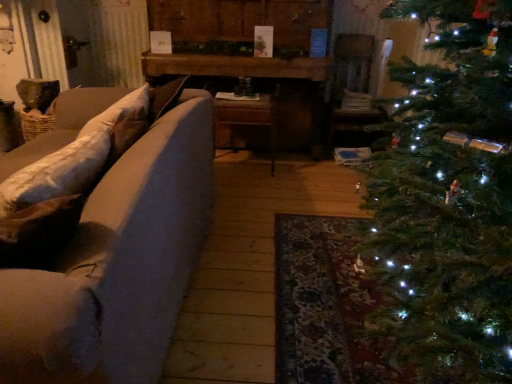
Where is `wooden table at center`? The width and height of the screenshot is (512, 384). wooden table at center is located at coordinates (255, 102).

Image resolution: width=512 pixels, height=384 pixels. What do you see at coordinates (255, 102) in the screenshot?
I see `wooden table at center` at bounding box center [255, 102].

Find the location of a particular element. Image resolution: width=512 pixels, height=384 pixels. matte gray couch at left is located at coordinates (118, 264).

What do you see at coordinates (118, 264) in the screenshot?
I see `matte gray couch at left` at bounding box center [118, 264].

The width and height of the screenshot is (512, 384). Identify the location of wooden table at center. (255, 102).

Considering the positions of objects wooden table at center and matte gray couch at left in the image provided, who is more to the right, wooden table at center or matte gray couch at left?

From the viewer's perspective, wooden table at center appears more on the right side.

Looking at this image, is wooden table at center closer to the viewer compared to matte gray couch at left?

No, it is behind matte gray couch at left.

Is point (272, 128) behind point (141, 210)?

Yes, it is.

From the image's perspective, is wooden table at center located above or below matte gray couch at left?

wooden table at center is situated higher than matte gray couch at left in the image.

From a real-world perspective, relative to matte gray couch at left, is wooden table at center vertically above or below?

From a real-world perspective, wooden table at center is physically above matte gray couch at left.

In terms of width, does wooden table at center look wider or thinner when compared to matte gray couch at left?

In the image, wooden table at center appears to be more narrow than matte gray couch at left.

In terms of height, does wooden table at center look taller or shorter compared to matte gray couch at left?

In the image, wooden table at center appears to be taller than matte gray couch at left.

In terms of size, does wooden table at center appear bigger or smaller than matte gray couch at left?

wooden table at center is smaller than matte gray couch at left.

Is wooden table at center spatially inside matte gray couch at left, or outside of it?

wooden table at center is not inside matte gray couch at left, it's outside.

Is wooden table at center in contact with matte gray couch at left?

No, wooden table at center is not beside matte gray couch at left.

Looking at this image, is wooden table at center facing towards matte gray couch at left?

Yes, wooden table at center is oriented towards matte gray couch at left.

What's the angular difference between wooden table at center and matte gray couch at left's facing directions?

The facing directions of wooden table at center and matte gray couch at left are 90.7 degrees apart.

Locate an element on the screen. The image size is (512, 384). table located on the right of matte gray couch at left is located at coordinates tap(255, 102).

Which object is positioned more to the right, matte gray couch at left or wooden table at center?

From the viewer's perspective, wooden table at center appears more on the right side.

Which object is more forward, matte gray couch at left or wooden table at center?

matte gray couch at left.

Which point is more forward, (120, 376) or (300, 125)?

The point (120, 376) is in front.

From the image's perspective, is matte gray couch at left on top of wooden table at center?

No.

From a real-world perspective, between matte gray couch at left and wooden table at center, who is vertically higher?

In real-world perspective, wooden table at center is above.

Based on the photo, which object is wider, matte gray couch at left or wooden table at center?

matte gray couch at left is wider.

Between matte gray couch at left and wooden table at center, which one has less height?

matte gray couch at left.

Based on their sizes in the image, would you say matte gray couch at left is bigger or smaller than wooden table at center?

In the image, matte gray couch at left appears to be larger than wooden table at center.

Is wooden table at center completely or partially inside matte gray couch at left?

No, wooden table at center is not surrounded by matte gray couch at left.

In the scene shown: Is matte gray couch at left not near wooden table at center?

Yes.

Could you tell me if matte gray couch at left is facing wooden table at center?

No, matte gray couch at left is not facing towards wooden table at center.

How different are the orientations of matte gray couch at left and wooden table at center in degrees?

The angular difference between matte gray couch at left and wooden table at center is 90.7 degrees.

Looking at this image, measure the distance from matte gray couch at left to wooden table at center.

A distance of 1.32 meters exists between matte gray couch at left and wooden table at center.

This screenshot has width=512, height=384. Find the location of `table behind the matte gray couch at left`. table behind the matte gray couch at left is located at coordinates (255, 102).

This screenshot has width=512, height=384. Find the location of `table lying on the right of matte gray couch at left`. table lying on the right of matte gray couch at left is located at coordinates (255, 102).

Find the location of a particular element. The width and height of the screenshot is (512, 384). studio couch located below the wooden table at center (from the image's perspective) is located at coordinates (118, 264).